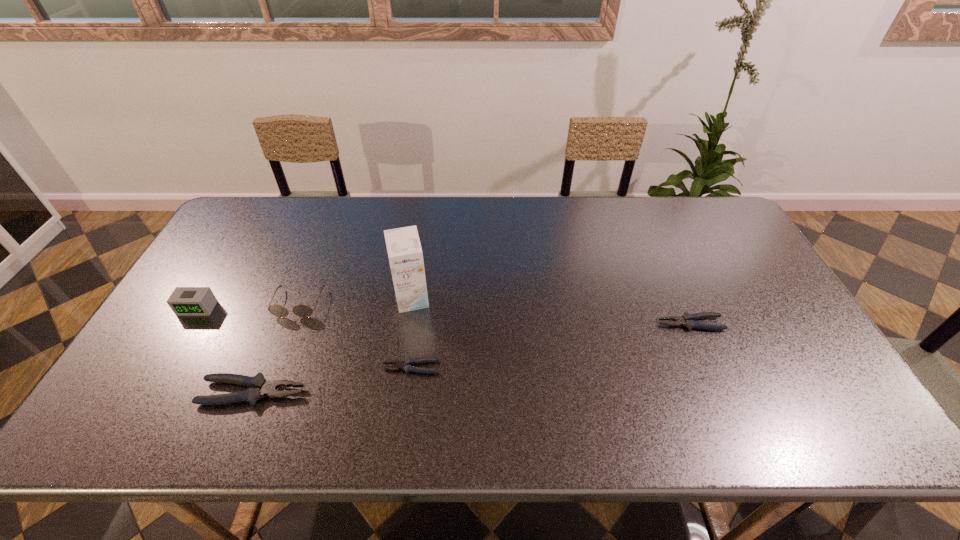
Where is `vacant space at the far edge of the desktop`? The height and width of the screenshot is (540, 960). vacant space at the far edge of the desktop is located at coordinates (x=540, y=235).

Image resolution: width=960 pixels, height=540 pixels. In the image, there is a desktop. Find the location of `vacant space at the near edge`. vacant space at the near edge is located at coordinates (653, 377).

The width and height of the screenshot is (960, 540). Find the location of `free space at the right edge`. free space at the right edge is located at coordinates (737, 289).

Where is `free space that is in between the leftmost object and the fifth farthest object`? free space that is in between the leftmost object and the fifth farthest object is located at coordinates (304, 338).

I want to click on free space that is in between the carton and the sunglasses, so click(355, 301).

Image resolution: width=960 pixels, height=540 pixels. Identify the location of vacant space in between the sunglasses and the shortest object. (355, 335).

The width and height of the screenshot is (960, 540). Find the location of `free spot between the sunglasses and the second farthest pliers`. free spot between the sunglasses and the second farthest pliers is located at coordinates (355, 335).

Where is `empty location between the sunglasses and the tallest pliers`? This screenshot has width=960, height=540. empty location between the sunglasses and the tallest pliers is located at coordinates (276, 348).

Locate an element on the screen. vacant point located between the nearest pliers and the tallest object is located at coordinates (332, 346).

Find the location of a particular element. This screenshot has width=960, height=540. vacant area between the carton and the rightmost object is located at coordinates (551, 312).